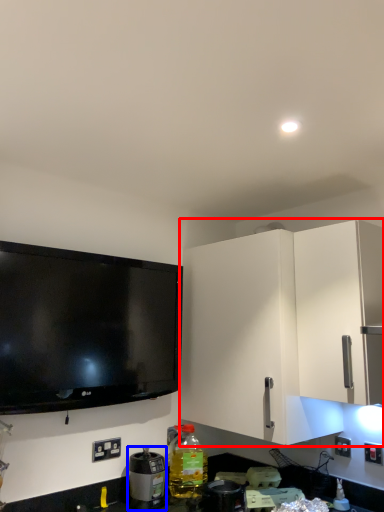
Question: Which object is closer to the camera taking this photo, cabinetry (highlighted by a red box) or appliance (highlighted by a blue box)?

Choices:
 (A) cabinetry
 (B) appliance

Answer: (A)